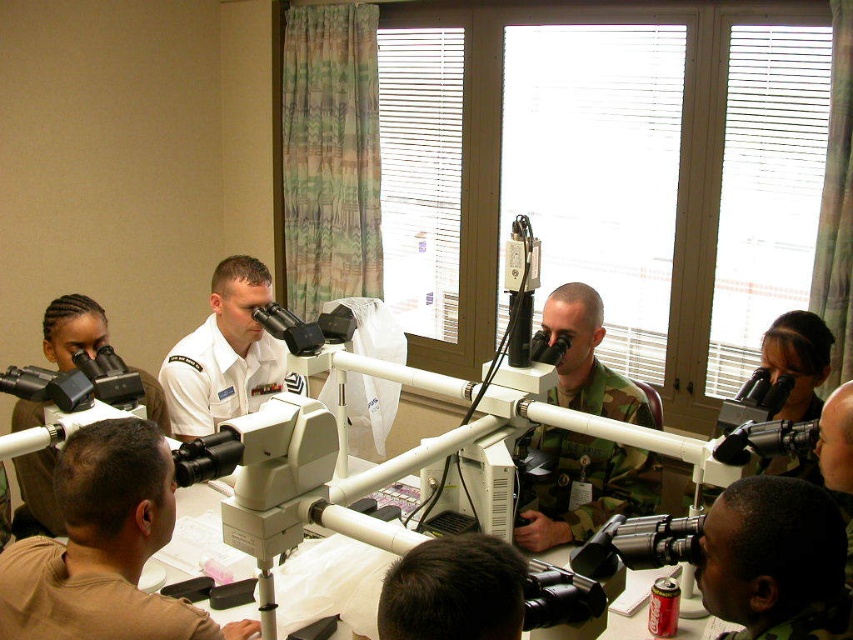
You are a photographer positioned at the back of the room. You need to capture a photo of both the camouflage uniform at center and the white uniform at center. Which uniform should you focus on first to ensure both are in frame without moving the camera?

You should focus on the camouflage uniform at center first because it is narrower than the white uniform at center, allowing you to position it in the frame while still accommodating the wider white uniform at center.

You are a new trainee in the room. You need to locate the camouflage uniform at center and the white uniform at center. Which one is closer to you?

The camouflage uniform at center is closer to you because it is in front of the white uniform at center.